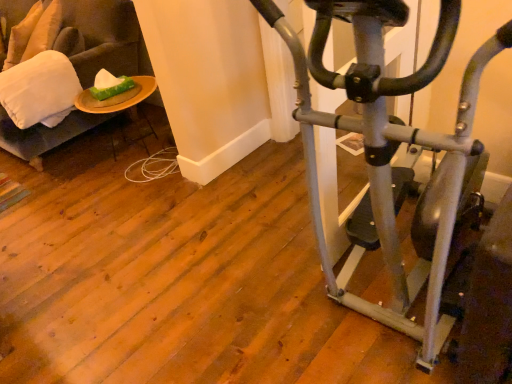
In order to face wooden plate at left, should I rotate leftwards or rightwards?

A 16.355 degree turn to the left will do.

This screenshot has width=512, height=384. What do you see at coordinates (117, 97) in the screenshot?
I see `wooden plate at left` at bounding box center [117, 97].

Describe the element at coordinates (387, 139) in the screenshot. I see `silver metallic stationary bicycle at right` at that location.

At what (x,y) coordinates should I click in order to perform the action: click on soft beige pillow at upper left, marked as the second pillow in a right-to-left arrangement. Please return your answer as a coordinate pair (x, y). The width and height of the screenshot is (512, 384). Looking at the image, I should click on (22, 35).

From the image's perspective, which one is positioned lower, green matte tissue at upper left or wooden plate at left?

wooden plate at left, from the image's perspective.

From the picture: Is green matte tissue at upper left taller or shorter than wooden plate at left?

Considering their sizes, green matte tissue at upper left has less height than wooden plate at left.

Is green matte tissue at upper left oriented away from wooden plate at left?

No, green matte tissue at upper left is not facing away from wooden plate at left.

Is green matte tissue at upper left situated inside wooden plate at left or outside?

green matte tissue at upper left is located beyond the bounds of wooden plate at left.

Who is smaller, white soft pillow at left, which is counted as the first pillow, starting from the right, or green matte tissue at upper left?

With smaller size is green matte tissue at upper left.

Is white soft pillow at left, which is counted as the 2th pillow, starting from the left, aimed at green matte tissue at upper left?

No, white soft pillow at left, which is counted as the 2th pillow, starting from the left, is not oriented towards green matte tissue at upper left.

Which of these two, white soft pillow at left, the 2th pillow from the top, or green matte tissue at upper left, stands taller?

With more height is white soft pillow at left, the 2th pillow from the top.

Is point (54, 107) closer to viewer compared to point (126, 78)?

Yes, point (54, 107) is closer to viewer.

How many degrees apart are the facing directions of green matte tissue at upper left and silver metallic stationary bicycle at right?

green matte tissue at upper left and silver metallic stationary bicycle at right are facing 7.66 degrees away from each other.

Between point (112, 85) and point (387, 324), which one is positioned in front?

The point (387, 324) is closer to the camera.

Looking at this image, considering the sizes of objects green matte tissue at upper left and silver metallic stationary bicycle at right in the image provided, who is smaller, green matte tissue at upper left or silver metallic stationary bicycle at right?

With smaller size is green matte tissue at upper left.

This screenshot has width=512, height=384. I want to click on stationary bicycle located in front of the green matte tissue at upper left, so click(387, 139).

Are white soft pillow at left, positioned as the first pillow in bottom-to-top order, and wooden plate at left located far from each other?

No, white soft pillow at left, positioned as the first pillow in bottom-to-top order, is not far away from wooden plate at left.

What's the angular difference between white soft pillow at left, the second pillow viewed from the back, and wooden plate at left's facing directions?

The facing directions of white soft pillow at left, the second pillow viewed from the back, and wooden plate at left are 0.931 degrees apart.

Which point is more forward, (x=11, y=88) or (x=139, y=102)?

The point (x=11, y=88) is closer to the camera.

In the scene shown: Between white soft pillow at left, the second pillow viewed from the back, and wooden plate at left, which one has smaller size?

Smaller between the two is wooden plate at left.

Is white soft pillow at left, which is counted as the first pillow, starting from the right, bigger than velvet beige swivel chair at left?

No, white soft pillow at left, which is counted as the first pillow, starting from the right, is not bigger than velvet beige swivel chair at left.

Is velvet beige swivel chair at left located within white soft pillow at left, the 2th pillow from the top?

No, white soft pillow at left, the 2th pillow from the top, does not contain velvet beige swivel chair at left.

Can you tell me how much white soft pillow at left, which is counted as the 2th pillow, starting from the left, and velvet beige swivel chair at left differ in facing direction?

0.000701 degrees separate the facing orientations of white soft pillow at left, which is counted as the 2th pillow, starting from the left, and velvet beige swivel chair at left.

Based on the photo, from the image's perspective, between wooden plate at left and silver metallic stationary bicycle at right, which one is located above?

wooden plate at left.

Is the depth of wooden plate at left greater than that of silver metallic stationary bicycle at right?

That is True.

Locate an element on the screen. The width and height of the screenshot is (512, 384). table located on the left of silver metallic stationary bicycle at right is located at coordinates (117, 97).

Does wooden plate at left have a greater width compared to silver metallic stationary bicycle at right?

Incorrect, the width of wooden plate at left does not surpass that of silver metallic stationary bicycle at right.

From the picture: From a real-world perspective, is silver metallic stationary bicycle at right located higher than green matte tissue at upper left?

Yes, from a real-world perspective, silver metallic stationary bicycle at right is over green matte tissue at upper left

From the image's perspective, is silver metallic stationary bicycle at right below green matte tissue at upper left?

Yes, from the image's perspective, silver metallic stationary bicycle at right is below green matte tissue at upper left.

Does point (428, 68) come behind point (130, 84)?

No, it is not.

Find the location of a particular element. The width and height of the screenshot is (512, 384). stationary bicycle located in front of the green matte tissue at upper left is located at coordinates (387, 139).

Identify the location of table below the green matte tissue at upper left (from the image's perspective). The height and width of the screenshot is (384, 512). (117, 97).

The height and width of the screenshot is (384, 512). In order to click on food above the white soft pillow at left, positioned as the first pillow in bottom-to-top order (from a real-world perspective) in this screenshot , I will do `click(110, 85)`.

Looking at the image, which one is located further to green matte tissue at upper left, velvet beige swivel chair at left or wooden plate at left?

velvet beige swivel chair at left.

Which object lies further to the anchor point silver metallic stationary bicycle at right, wooden plate at left or soft beige pillow at upper left, positioned as the first pillow in back-to-front order?

Among the two, soft beige pillow at upper left, positioned as the first pillow in back-to-front order, is located further to silver metallic stationary bicycle at right.

Which object lies nearer to the anchor point wooden plate at left, velvet beige swivel chair at left or soft beige pillow at upper left, acting as the second pillow starting from the front?

velvet beige swivel chair at left is positioned closer to the anchor wooden plate at left.

When comparing their distances from soft beige pillow at upper left, positioned as the first pillow in back-to-front order, does green matte tissue at upper left or silver metallic stationary bicycle at right seem further?

silver metallic stationary bicycle at right is further to soft beige pillow at upper left, positioned as the first pillow in back-to-front order.

When comparing their distances from white soft pillow at left, positioned as the first pillow in bottom-to-top order, does soft beige pillow at upper left, acting as the second pillow starting from the bottom, or velvet beige swivel chair at left seem further?

Based on the image, soft beige pillow at upper left, acting as the second pillow starting from the bottom, appears to be further to white soft pillow at left, positioned as the first pillow in bottom-to-top order.

From the image, which object appears to be nearer to soft beige pillow at upper left, acting as the second pillow starting from the front, white soft pillow at left, positioned as the first pillow in bottom-to-top order, or green matte tissue at upper left?

Based on the image, white soft pillow at left, positioned as the first pillow in bottom-to-top order, appears to be nearer to soft beige pillow at upper left, acting as the second pillow starting from the front.

From the image, which object appears to be nearer to silver metallic stationary bicycle at right, white soft pillow at left, which is counted as the first pillow, starting from the right, or green matte tissue at upper left?

green matte tissue at upper left.

From the image, which object appears to be farther from silver metallic stationary bicycle at right, green matte tissue at upper left or wooden plate at left?

green matte tissue at upper left.

You are a GUI agent. You are given a task and a screenshot of the screen. Output one action in this format:
    pyautogui.click(x=<x>, y=<y>)
    Task: Click on the swivel chair between soft beige pillow at upper left, positioned as the 1th pillow in top-to-bottom order, and green matte tissue at upper left, in the horizontal direction
    Image resolution: width=512 pixels, height=384 pixels.
    Given the screenshot: What is the action you would take?
    pyautogui.click(x=101, y=38)

Where is `pillow situated between velvet beige swivel chair at left and silver metallic stationary bicycle at right from left to right`? This screenshot has width=512, height=384. pillow situated between velvet beige swivel chair at left and silver metallic stationary bicycle at right from left to right is located at coordinates (40, 90).

I want to click on food between silver metallic stationary bicycle at right and soft beige pillow at upper left, acting as the second pillow starting from the bottom, in the front-back direction, so (x=110, y=85).

The height and width of the screenshot is (384, 512). In order to click on pillow between silver metallic stationary bicycle at right and green matte tissue at upper left in the front-back direction in this screenshot , I will do `click(40, 90)`.